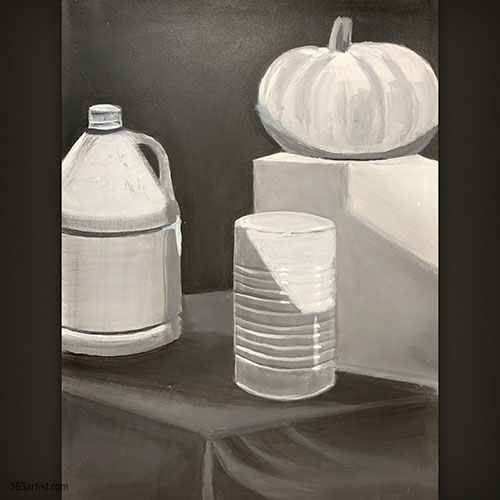
Where is `table cloth`? Image resolution: width=500 pixels, height=500 pixels. table cloth is located at coordinates (327, 438).